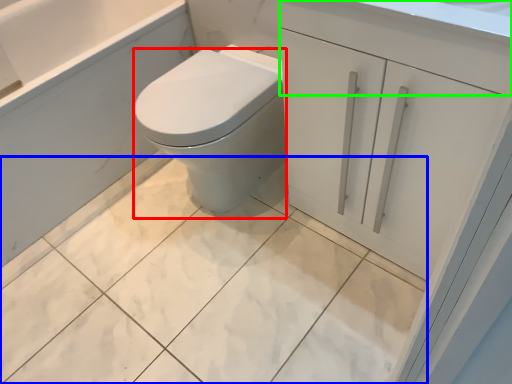
Question: Estimate the real-world distances between objects in this image. Which object is closer to bidet (highlighted by a red box), ceramic tile (highlighted by a blue box) or drawer (highlighted by a green box)?

Choices:
 (A) ceramic tile
 (B) drawer

Answer: (A)